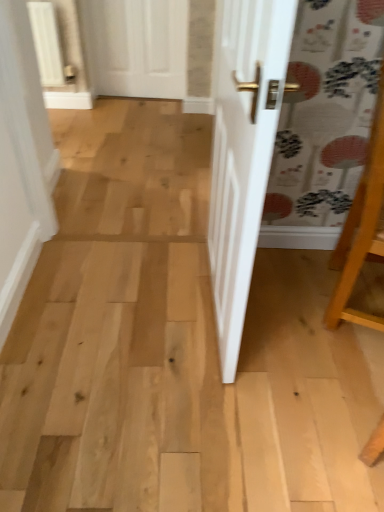
What do you see at coordinates (135, 47) in the screenshot? I see `white matte door at upper center` at bounding box center [135, 47].

At what (x,y) coordinates should I click in order to perform the action: click on white matte door at upper center. Please return your answer as a coordinate pair (x, y). Looking at the image, I should click on (135, 47).

This screenshot has width=384, height=512. What do you see at coordinates (361, 229) in the screenshot? I see `wooden easel at right` at bounding box center [361, 229].

This screenshot has width=384, height=512. I want to click on wooden easel at right, so click(361, 229).

Where is `white matte door at upper center`? This screenshot has width=384, height=512. white matte door at upper center is located at coordinates (135, 47).

Considering the relative positions of white matte door at upper center and wooden easel at right in the image provided, is white matte door at upper center to the left of wooden easel at right from the viewer's perspective?

Indeed, white matte door at upper center is positioned on the left side of wooden easel at right.

Based on the photo, is white matte door at upper center further to the viewer compared to wooden easel at right?

Yes, it is behind wooden easel at right.

Is point (164, 27) farther from camera compared to point (366, 315)?

Yes, it is.

From the image's perspective, is white matte door at upper center located above or below wooden easel at right?

white matte door at upper center is above wooden easel at right.

From a real-world perspective, is white matte door at upper center over wooden easel at right?

No.

Is white matte door at upper center wider or thinner than wooden easel at right?

Considering their sizes, white matte door at upper center looks slimmer than wooden easel at right.

Which of these two, white matte door at upper center or wooden easel at right, stands taller?

Standing taller between the two is wooden easel at right.

Is white matte door at upper center smaller than wooden easel at right?

Correct, white matte door at upper center occupies less space than wooden easel at right.

Would you say white matte door at upper center is inside or outside wooden easel at right?

white matte door at upper center is not enclosed by wooden easel at right.

Is white matte door at upper center with wooden easel at right?

No, white matte door at upper center is not making contact with wooden easel at right.

Looking at this image, is white matte door at upper center turned away from wooden easel at right?

No, white matte door at upper center's orientation is not away from wooden easel at right.

How far apart are white matte door at upper center and wooden easel at right?

white matte door at upper center and wooden easel at right are 2.11 meters apart from each other.

This screenshot has height=512, width=384. I want to click on door behind the wooden easel at right, so click(135, 47).

Which is more to the left, wooden easel at right or white matte door at upper center?

white matte door at upper center.

Considering the positions of objects wooden easel at right and white matte door at upper center in the image provided, who is behind, wooden easel at right or white matte door at upper center?

Positioned behind is white matte door at upper center.

Which is nearer, (337, 269) or (107, 14)?

The point (337, 269) is closer.

From the image's perspective, is wooden easel at right above or below white matte door at upper center?

wooden easel at right is below white matte door at upper center.

From a real-world perspective, is wooden easel at right above or below white matte door at upper center?

wooden easel at right is situated higher than white matte door at upper center in the real world.

Between wooden easel at right and white matte door at upper center, which one has larger width?

Wider between the two is wooden easel at right.

Who is shorter, wooden easel at right or white matte door at upper center?

white matte door at upper center.

Is wooden easel at right smaller than white matte door at upper center?

No, wooden easel at right is not smaller than white matte door at upper center.

Can white matte door at upper center be found inside wooden easel at right?

No, white matte door at upper center is not a part of wooden easel at right.

Is wooden easel at right far away from white matte door at upper center?

Absolutely, wooden easel at right is distant from white matte door at upper center.

Is white matte door at upper center at the back of wooden easel at right?

wooden easel at right does not have its back to white matte door at upper center.

You are a GUI agent. You are given a task and a screenshot of the screen. Output one action in this format:
    pyautogui.click(x=<x>, y=<y>)
    Task: Click on the furniture on the right side of white matte door at upper center
    This screenshot has width=384, height=512.
    Given the screenshot: What is the action you would take?
    pyautogui.click(x=361, y=229)

The height and width of the screenshot is (512, 384). Find the location of `door located behind the wooden easel at right`. door located behind the wooden easel at right is located at coordinates (x=135, y=47).

Find the location of `furniture in front of the white matte door at upper center`. furniture in front of the white matte door at upper center is located at coordinates (361, 229).